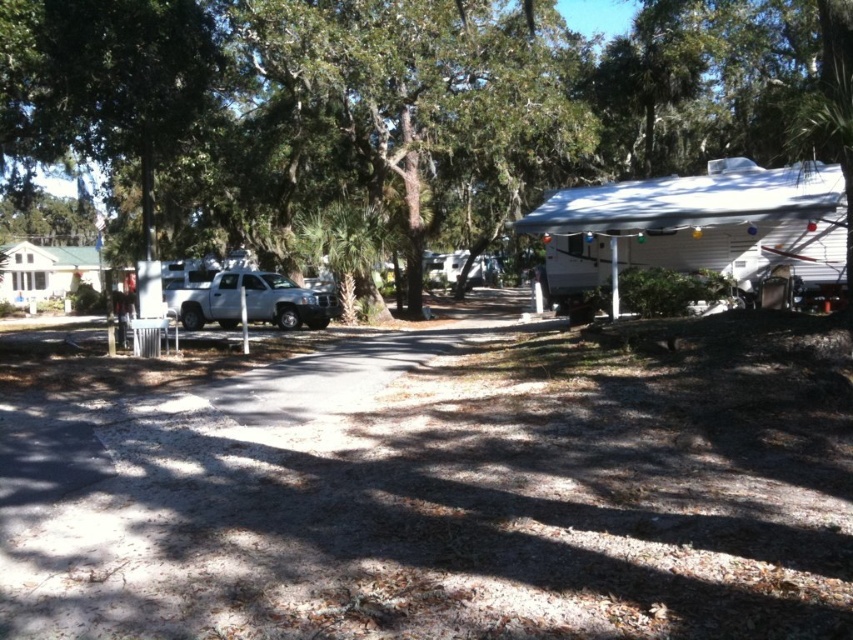
Is white matte camper at right positioned before silver metallic truck at center-left?

Yes, it is.

Who is more distant from viewer, (817, 170) or (293, 291)?

Positioned behind is point (293, 291).

At what (x,y) coordinates should I click in order to perform the action: click on white matte camper at right. Please return your answer as a coordinate pair (x, y). The height and width of the screenshot is (640, 853). Looking at the image, I should click on (697, 227).

Describe the element at coordinates (397, 106) in the screenshot. Image resolution: width=853 pixels, height=640 pixels. I see `green leafy tree at center` at that location.

Locate an element on the screen. The height and width of the screenshot is (640, 853). green leafy tree at center is located at coordinates (397, 106).

Locate an element on the screen. The image size is (853, 640). green leafy tree at center is located at coordinates (397, 106).

Does green leafy tree at center appear under white matte camper at right?

No, green leafy tree at center is not below white matte camper at right.

Can you confirm if green leafy tree at center is positioned above white matte camper at right?

Indeed, green leafy tree at center is positioned over white matte camper at right.

At what (x,y) coordinates should I click in order to perform the action: click on green leafy tree at center. Please return your answer as a coordinate pair (x, y). The image size is (853, 640). Looking at the image, I should click on (397, 106).